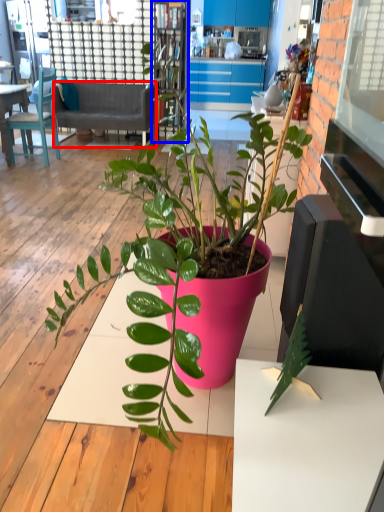
Question: Among these objects, which one is nearest to the camera, studio couch (highlighted by a red box) or bookshelf (highlighted by a blue box)?

Choices:
 (A) studio couch
 (B) bookshelf

Answer: (B)